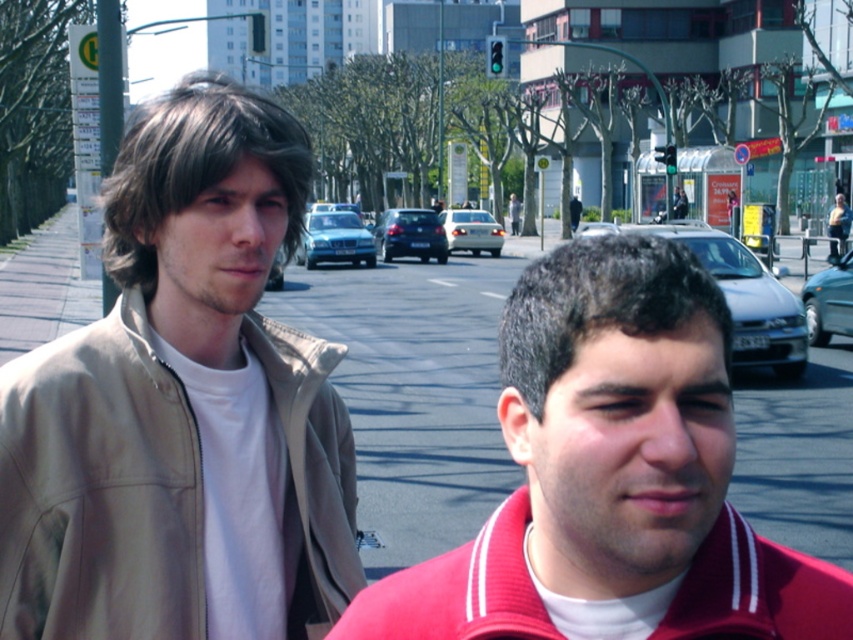
Question: Is shiny black sedan at center smaller than sleek black sedan at center?

Choices:
 (A) no
 (B) yes

Answer: (A)

Question: Considering the real-world distances, which object is farthest from the silver metallic sedan at center?

Choices:
 (A) paved asphalt at lower center
 (B) blue metallic sedan at center
 (C) matte black sedan at center
 (D) shiny black sedan at center

Answer: (D)

Question: Can you confirm if beige fabric jacket at left is thinner than paved asphalt at lower center?

Choices:
 (A) yes
 (B) no

Answer: (A)

Question: Can you confirm if teal glossy sedan at right is positioned to the left of silver metallic sedan at center?

Choices:
 (A) no
 (B) yes

Answer: (A)

Question: Which of the following is the closest to the observer?

Choices:
 (A) beige fabric jacket at left
 (B) shiny black sedan at center

Answer: (B)

Question: Estimate the real-world distances between objects in this image. Which object is farther from the silver metallic sedan at center?

Choices:
 (A) paved asphalt at lower center
 (B) beige fabric jacket at left
 (C) red fleece sweatshirt at lower right
 (D) teal glossy sedan at right

Answer: (C)